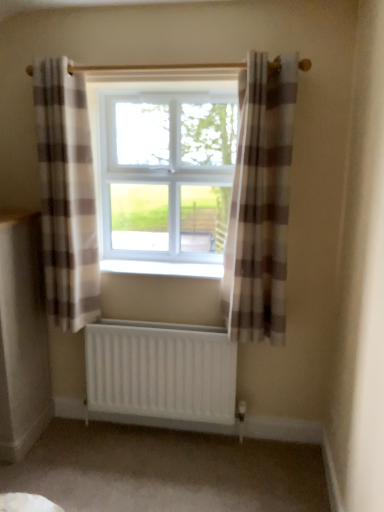
Based on the photo, how much space does plaid fabric curtain at center, arranged as the second curtain when viewed from the left, occupy vertically?

4.70 feet.

Image resolution: width=384 pixels, height=512 pixels. Describe the element at coordinates (163, 268) in the screenshot. I see `white plastic radiator at center` at that location.

Identify the location of white matte radiator at lower center. point(161,371).

What do you see at coordinates (164, 166) in the screenshot? The width and height of the screenshot is (384, 512). I see `white plastic window at center` at bounding box center [164, 166].

The image size is (384, 512). I want to click on white plastic window at center, so click(164, 166).

What do you see at coordinates (66, 194) in the screenshot? Image resolution: width=384 pixels, height=512 pixels. I see `plaid fabric curtain at left, placed as the first curtain when sorted from left to right` at bounding box center [66, 194].

At what (x,y) coordinates should I click in order to perform the action: click on plaid fabric curtain at left, the 2th curtain from the right. Please return your answer as a coordinate pair (x, y). This screenshot has height=512, width=384. Looking at the image, I should click on pyautogui.click(x=66, y=194).

This screenshot has height=512, width=384. I want to click on plaid fabric curtain at center, which ranks as the first curtain in right-to-left order, so click(260, 202).

Considering the points (91, 313) and (176, 192), which point is behind, point (91, 313) or point (176, 192)?

The point (176, 192) is more distant.

The height and width of the screenshot is (512, 384). In order to click on window above the plaid fabric curtain at left, the 2th curtain from the right (from the image's perspective) in this screenshot , I will do `click(164, 166)`.

Is white plastic window at center inside plaid fabric curtain at left, the 2th curtain from the right?

No, white plastic window at center is not inside plaid fabric curtain at left, the 2th curtain from the right.

What's the angular difference between white plastic radiator at center and white matte radiator at lower center's facing directions?

The facing directions of white plastic radiator at center and white matte radiator at lower center are 0.0108 degrees apart.

This screenshot has height=512, width=384. In order to click on window sill above the white matte radiator at lower center (from a real-world perspective) in this screenshot , I will do `click(163, 268)`.

Consider the image. Are white plastic radiator at center and white matte radiator at lower center far apart?

No, there isn't a large distance between white plastic radiator at center and white matte radiator at lower center.

Who is bigger, white plastic radiator at center or white matte radiator at lower center?

white matte radiator at lower center.

Considering the sizes of objects white plastic window at center and white plastic radiator at center in the image provided, who is taller, white plastic window at center or white plastic radiator at center?

Standing taller between the two is white plastic window at center.

Identify the location of window sill below the white plastic window at center (from a real-world perspective). The width and height of the screenshot is (384, 512). (163, 268).

From the image's perspective, which one is positioned higher, white plastic window at center or white plastic radiator at center?

white plastic window at center is shown above in the image.

Is the surface of white plastic window at center in direct contact with white plastic radiator at center?

There is a gap between white plastic window at center and white plastic radiator at center.

From a real-world perspective, which object rests below the other?

From a 3D spatial view, plaid fabric curtain at left, placed as the first curtain when sorted from left to right, is below.

Which is more to the left, white plastic window at center or plaid fabric curtain at left, placed as the first curtain when sorted from left to right?

Positioned to the left is plaid fabric curtain at left, placed as the first curtain when sorted from left to right.

Is white plastic window at center smaller than plaid fabric curtain at left, the 2th curtain from the right?

No.

Can you tell me how much white plastic window at center and plaid fabric curtain at left, placed as the first curtain when sorted from left to right, differ in facing direction?

The angular difference between white plastic window at center and plaid fabric curtain at left, placed as the first curtain when sorted from left to right, is 0.00321 degrees.

Identify the location of curtain that is on the right side of white plastic window at center. (260, 202).

Looking at this image, from a real-world perspective, is plaid fabric curtain at center, arranged as the second curtain when viewed from the left, located beneath white plastic window at center?

Correct, in the physical world, plaid fabric curtain at center, arranged as the second curtain when viewed from the left, is lower than white plastic window at center.

Looking at this image, which of these two, plaid fabric curtain at center, arranged as the second curtain when viewed from the left, or white plastic window at center, is smaller?

Smaller between the two is plaid fabric curtain at center, arranged as the second curtain when viewed from the left.

Considering the positions of point (281, 185) and point (221, 246), is point (281, 185) closer or farther from the camera than point (221, 246)?

Clearly, point (281, 185) is closer to the camera than point (221, 246).

How distant is plaid fabric curtain at center, arranged as the second curtain when viewed from the left, from white matte radiator at lower center?

plaid fabric curtain at center, arranged as the second curtain when viewed from the left, is 22.93 inches from white matte radiator at lower center.

From the image's perspective, which one is positioned higher, plaid fabric curtain at center, which ranks as the first curtain in right-to-left order, or white matte radiator at lower center?

plaid fabric curtain at center, which ranks as the first curtain in right-to-left order, from the image's perspective.

Which of these two, plaid fabric curtain at center, arranged as the second curtain when viewed from the left, or white matte radiator at lower center, stands shorter?

white matte radiator at lower center.

Is plaid fabric curtain at center, arranged as the second curtain when viewed from the left, inside or outside of white matte radiator at lower center?

plaid fabric curtain at center, arranged as the second curtain when viewed from the left, is located beyond the bounds of white matte radiator at lower center.

Which is closer to the camera, (145,273) or (93,292)?

The point (145,273) is closer.

Is white plastic radiator at center in contact with plaid fabric curtain at left, the 2th curtain from the right?

No, white plastic radiator at center is not beside plaid fabric curtain at left, the 2th curtain from the right.

From a real-world perspective, who is located higher, white plastic radiator at center or plaid fabric curtain at left, the 2th curtain from the right?

In real-world perspective, plaid fabric curtain at left, the 2th curtain from the right, is above.

Consider the image. Considering the relative positions of white plastic radiator at center and plaid fabric curtain at left, the 2th curtain from the right, in the image provided, is white plastic radiator at center behind plaid fabric curtain at left, the 2th curtain from the right,?

Yes, the depth of white plastic radiator at center is greater than that of plaid fabric curtain at left, the 2th curtain from the right.

Find the location of `window on the right of plaid fabric curtain at left, the 2th curtain from the right`. window on the right of plaid fabric curtain at left, the 2th curtain from the right is located at coordinates (164, 166).

This screenshot has width=384, height=512. I want to click on window sill above the white matte radiator at lower center (from a real-world perspective), so click(x=163, y=268).

Considering their positions, is white plastic window at center positioned closer to white matte radiator at lower center than white plastic radiator at center?

white plastic radiator at center.

Estimate the real-world distances between objects in this image. Which object is further from plaid fabric curtain at left, the 2th curtain from the right, white matte radiator at lower center or white plastic radiator at center?

Based on the image, white matte radiator at lower center appears to be further to plaid fabric curtain at left, the 2th curtain from the right.

Which object lies further to the anchor point white plastic window at center, plaid fabric curtain at left, placed as the first curtain when sorted from left to right, or white matte radiator at lower center?

Based on the image, white matte radiator at lower center appears to be further to white plastic window at center.

Based on their spatial positions, is plaid fabric curtain at center, arranged as the second curtain when viewed from the left, or white matte radiator at lower center further from plaid fabric curtain at left, placed as the first curtain when sorted from left to right?

plaid fabric curtain at center, arranged as the second curtain when viewed from the left.

Estimate the real-world distances between objects in this image. Which object is closer to white matte radiator at lower center, white plastic radiator at center or plaid fabric curtain at center, arranged as the second curtain when viewed from the left?

white plastic radiator at center is positioned closer to the anchor white matte radiator at lower center.

From the image, which object appears to be nearer to white matte radiator at lower center, white plastic window at center or plaid fabric curtain at left, placed as the first curtain when sorted from left to right?

plaid fabric curtain at left, placed as the first curtain when sorted from left to right.

When comparing their distances from plaid fabric curtain at left, the 2th curtain from the right, does white plastic window at center or white matte radiator at lower center seem closer?

white plastic window at center lies closer to plaid fabric curtain at left, the 2th curtain from the right, than the other object.

Which object lies further to the anchor point plaid fabric curtain at left, placed as the first curtain when sorted from left to right, white matte radiator at lower center or white plastic window at center?

white matte radiator at lower center lies further to plaid fabric curtain at left, placed as the first curtain when sorted from left to right, than the other object.

I want to click on window sill located between plaid fabric curtain at left, placed as the first curtain when sorted from left to right, and plaid fabric curtain at center, which ranks as the first curtain in right-to-left order, in the left-right direction, so click(163, 268).

Find the location of `window sill between plaid fabric curtain at left, placed as the first curtain when sorted from left to right, and white matte radiator at lower center from top to bottom`. window sill between plaid fabric curtain at left, placed as the first curtain when sorted from left to right, and white matte radiator at lower center from top to bottom is located at coordinates (163, 268).

Image resolution: width=384 pixels, height=512 pixels. Find the location of `window sill between plaid fabric curtain at left, placed as the first curtain when sorted from left to right, and white plastic window at center, in the horizontal direction`. window sill between plaid fabric curtain at left, placed as the first curtain when sorted from left to right, and white plastic window at center, in the horizontal direction is located at coordinates (163, 268).

Identify the location of window sill between plaid fabric curtain at center, which ranks as the first curtain in right-to-left order, and white matte radiator at lower center, in the vertical direction. The height and width of the screenshot is (512, 384). (163, 268).